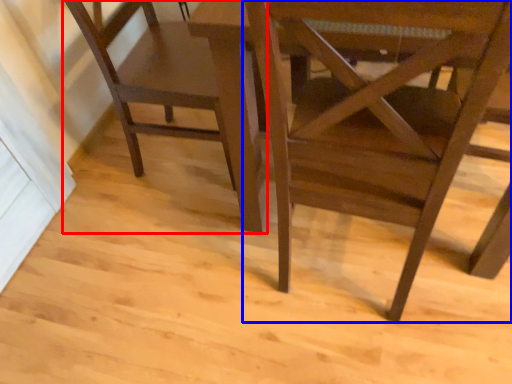
Question: Among these objects, which one is farthest to the camera, chair (highlighted by a red box) or chair (highlighted by a blue box)?

Choices:
 (A) chair
 (B) chair

Answer: (A)